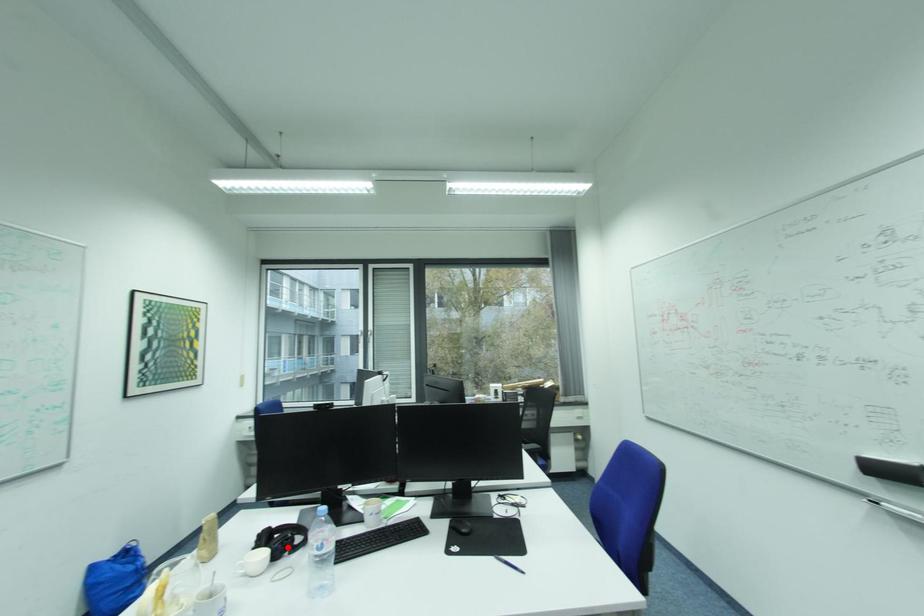
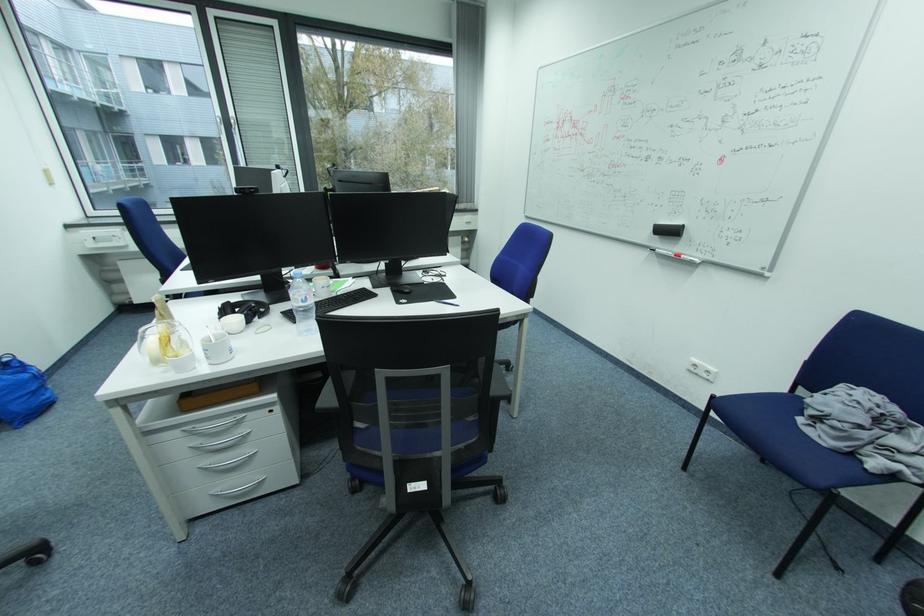
Find the pixel in the second image that matches the highlighted location in the first image.

(259, 313)